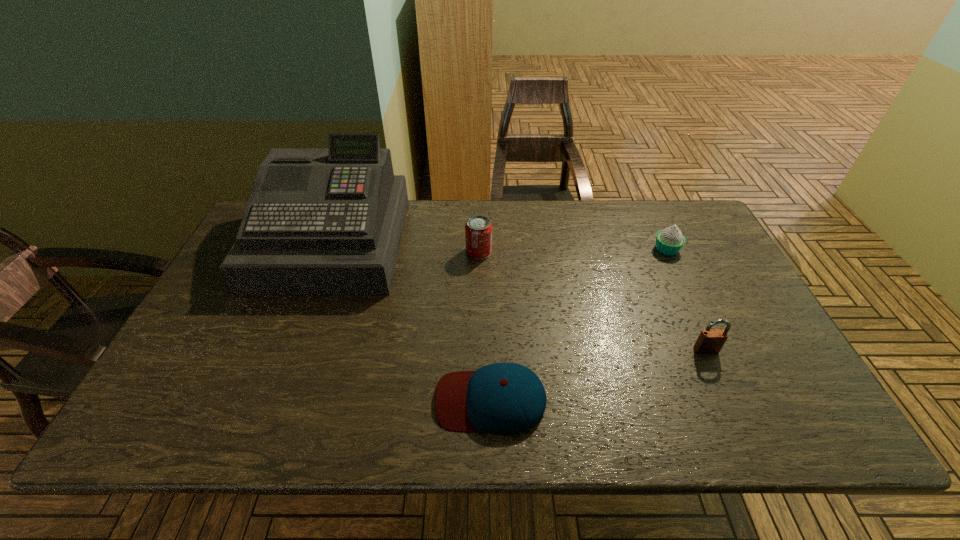
Locate an element on the screen. Image resolution: width=960 pixels, height=540 pixels. free spot between the baseball cap and the cupcake is located at coordinates (579, 325).

Where is `free area in between the can and the tallest object`? free area in between the can and the tallest object is located at coordinates (405, 247).

Locate an element on the screen. vacant space that is in between the second nearest object and the nearest object is located at coordinates (598, 375).

This screenshot has height=540, width=960. I want to click on free space that is in between the cupcake and the fourth farthest object, so (x=686, y=300).

You are a GUI agent. You are given a task and a screenshot of the screen. Output one action in this format:
    pyautogui.click(x=<x>, y=<y>)
    Task: Click on the free space between the can and the fourth farthest object
    
    Given the screenshot: What is the action you would take?
    pyautogui.click(x=592, y=301)

Locate an element on the screen. This screenshot has height=540, width=960. empty space that is in between the can and the second shortest object is located at coordinates (572, 251).

This screenshot has width=960, height=540. Find the location of `vacant area that lies between the baseball cap and the can`. vacant area that lies between the baseball cap and the can is located at coordinates (485, 326).

Where is `vacant space that's between the leftmost object and the baseball cap`? vacant space that's between the leftmost object and the baseball cap is located at coordinates (411, 321).

This screenshot has height=540, width=960. In order to click on the closest object relative to the tallest object in this screenshot , I will do tap(478, 229).

Where is `object that is the closest to the fourth farthest object`? object that is the closest to the fourth farthest object is located at coordinates (669, 241).